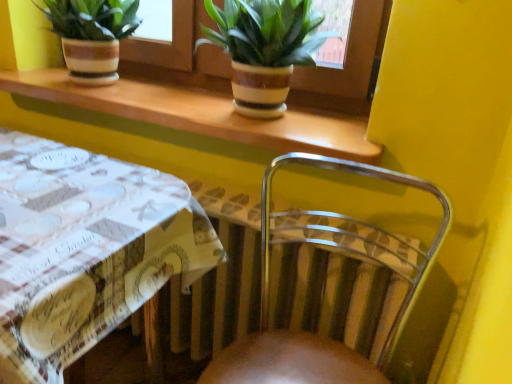
Question: From the image's perspective, is clear plastic chair at lower right on white printed fabric at lower left?

Choices:
 (A) no
 (B) yes

Answer: (A)

Question: Is the depth of clear plastic chair at lower right greater than that of white printed fabric at lower left?

Choices:
 (A) yes
 (B) no

Answer: (B)

Question: From a real-world perspective, is clear plastic chair at lower right located beneath white printed fabric at lower left?

Choices:
 (A) no
 (B) yes

Answer: (A)

Question: Considering the relative sizes of clear plastic chair at lower right and white printed fabric at lower left in the image provided, is clear plastic chair at lower right smaller than white printed fabric at lower left?

Choices:
 (A) yes
 (B) no

Answer: (A)

Question: Does clear plastic chair at lower right have a larger size compared to white printed fabric at lower left?

Choices:
 (A) no
 (B) yes

Answer: (A)

Question: Is white printed fabric at lower left in front of or behind green leafy plant in striped pot at upper center, acting as the second houseplant starting from the left, in the image?

Choices:
 (A) behind
 (B) front

Answer: (B)

Question: Is white printed fabric at lower left situated inside green leafy plant in striped pot at upper center, the first houseplant positioned from the right, or outside?

Choices:
 (A) inside
 (B) outside

Answer: (B)

Question: From a real-world perspective, is white printed fabric at lower left positioned above or below green leafy plant in striped pot at upper center, the first houseplant positioned from the right?

Choices:
 (A) above
 (B) below

Answer: (B)

Question: In terms of height, does white printed fabric at lower left look taller or shorter compared to green leafy plant in striped pot at upper center, the first houseplant positioned from the right?

Choices:
 (A) short
 (B) tall

Answer: (B)

Question: From the image's perspective, is green leafy plant in striped pot at upper center, the first houseplant positioned from the right, positioned above or below white printed fabric at lower left?

Choices:
 (A) below
 (B) above

Answer: (B)

Question: In terms of height, does green leafy plant in striped pot at upper center, the first houseplant positioned from the right, look taller or shorter compared to white printed fabric at lower left?

Choices:
 (A) short
 (B) tall

Answer: (A)

Question: Visually, is green leafy plant in striped pot at upper center, acting as the second houseplant starting from the left, positioned to the left or to the right of white printed fabric at lower left?

Choices:
 (A) left
 (B) right

Answer: (B)

Question: In terms of size, does green leafy plant in striped pot at upper center, the first houseplant positioned from the right, appear bigger or smaller than white printed fabric at lower left?

Choices:
 (A) big
 (B) small

Answer: (B)

Question: From a real-world perspective, is matte striped pot at upper left, positioned as the second houseplant in right-to-left order, physically located above or below white printed fabric at lower left?

Choices:
 (A) below
 (B) above

Answer: (B)

Question: Based on their positions, is matte striped pot at upper left, the 1th houseplant when ordered from left to right, located to the left or right of white printed fabric at lower left?

Choices:
 (A) right
 (B) left

Answer: (A)